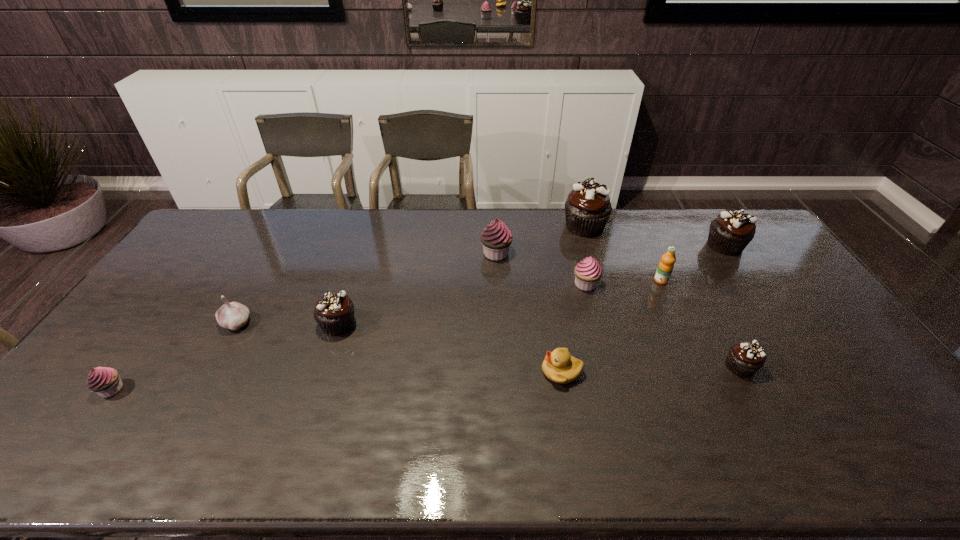
Identify the location of the biggest brown cupcake. The height and width of the screenshot is (540, 960). (587, 208).

Locate an element on the screen. The image size is (960, 540). the tallest object is located at coordinates (587, 208).

Identify the location of the rightmost cupcake. (729, 234).

Locate an element on the screen. the third smallest brown cupcake is located at coordinates (729, 234).

Image resolution: width=960 pixels, height=540 pixels. What are the coordinates of `the second pink cupcake from right to left` in the screenshot? It's located at (496, 238).

This screenshot has width=960, height=540. In order to click on the fourth object from left to right in this screenshot , I will do `click(496, 238)`.

Identify the location of the third object from right to left. Image resolution: width=960 pixels, height=540 pixels. (666, 265).

The height and width of the screenshot is (540, 960). In order to click on the third biggest brown cupcake in this screenshot , I will do `click(334, 312)`.

Find the location of a particular element. The width and height of the screenshot is (960, 540). the sixth cupcake from right to left is located at coordinates (334, 312).

The height and width of the screenshot is (540, 960). Find the location of `the second smallest pink cupcake`. the second smallest pink cupcake is located at coordinates (588, 271).